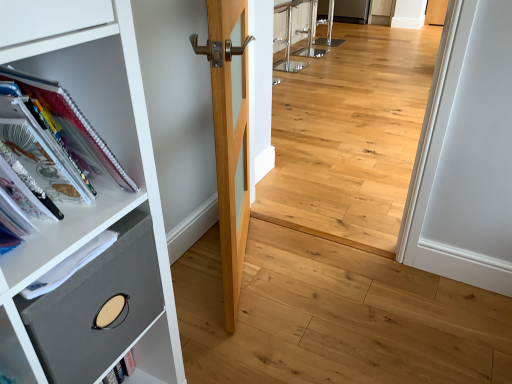
Question: Is light wood door at center in front of or behind natural wood floor at center in the image?

Choices:
 (A) behind
 (B) front

Answer: (B)

Question: Considering the positions of point (208, 26) and point (296, 218), is point (208, 26) closer or farther from the camera than point (296, 218)?

Choices:
 (A) closer
 (B) farther

Answer: (A)

Question: Estimate the real-world distances between objects in this image. Which object is closer to the light wood door at center?

Choices:
 (A) gray fabric drawer at left
 (B) spiral-bound paper at left
 (C) natural wood floor at center

Answer: (B)

Question: Which object is the closest to the gray fabric drawer at left?

Choices:
 (A) spiral-bound paper at left
 (B) light wood door at center
 (C) natural wood floor at center

Answer: (A)